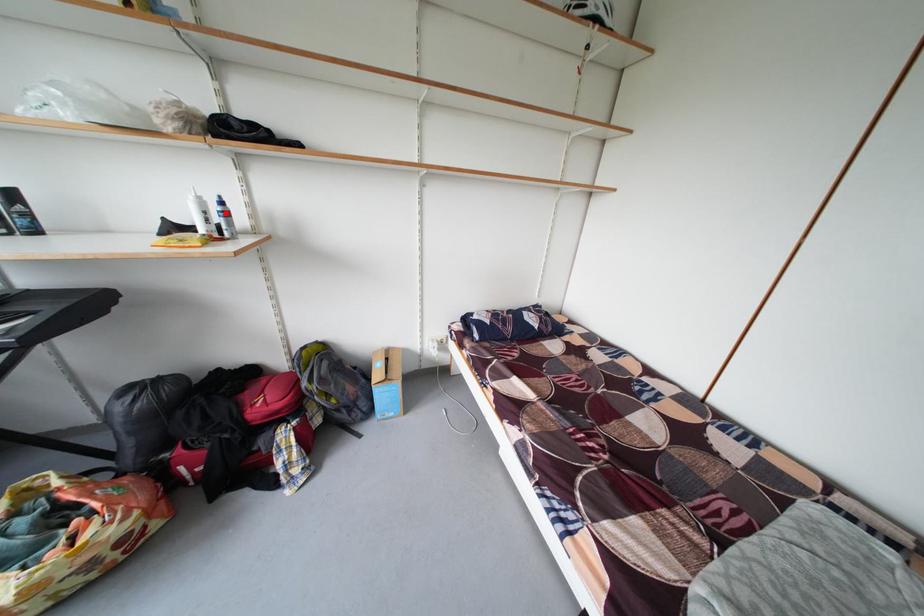
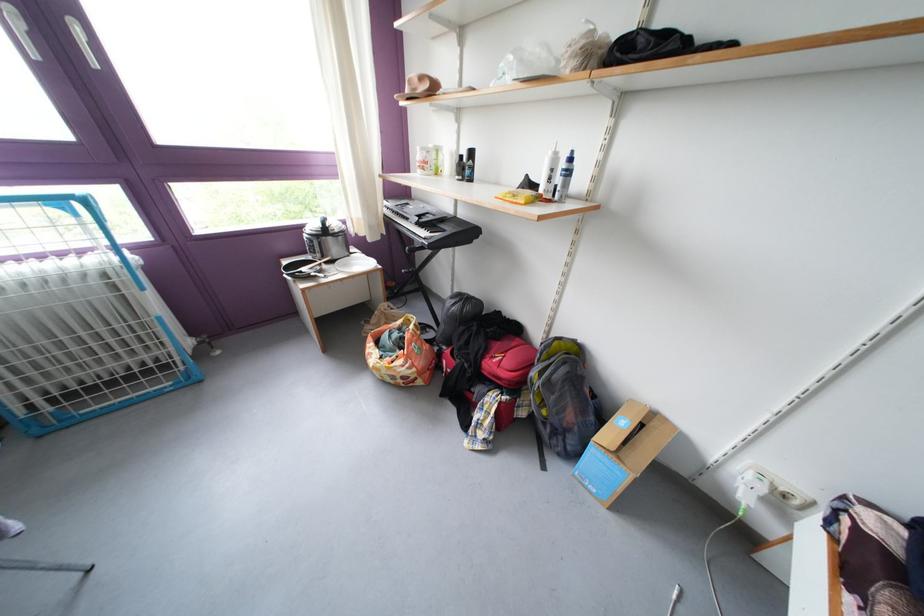
Find the pixel in the second image that matches the highlighted location in the first image.

(573, 169)